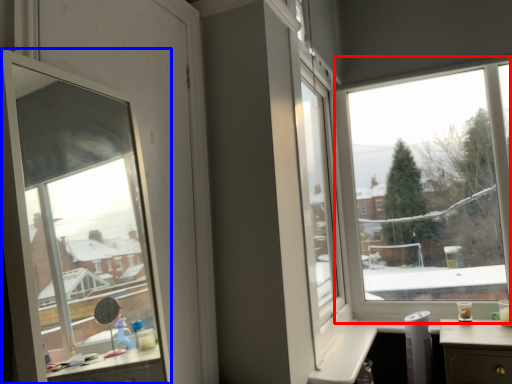
Question: Which object is closer to the camera taking this photo, window (highlighted by a red box) or window (highlighted by a blue box)?

Choices:
 (A) window
 (B) window

Answer: (B)